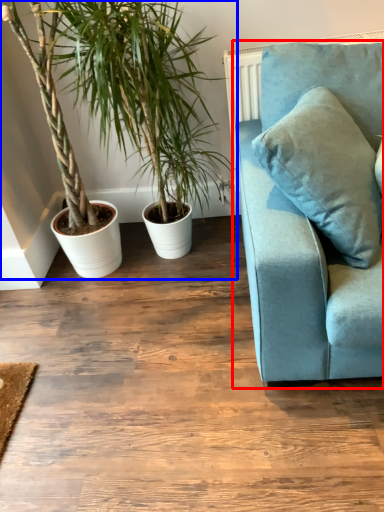
Question: Which object appears farthest to the camera in this image, studio couch (highlighted by a red box) or houseplant (highlighted by a blue box)?

Choices:
 (A) studio couch
 (B) houseplant

Answer: (B)